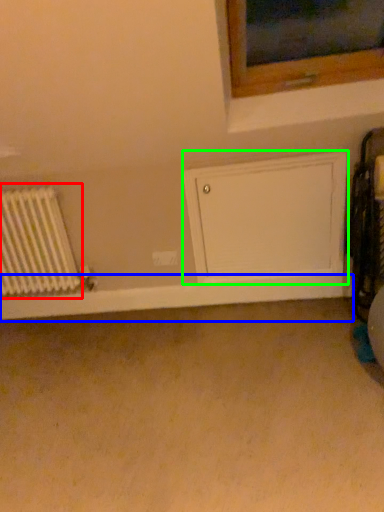
Question: Estimate the real-world distances between objects in this image. Which object is closer to radiator (highlighted by a red box), window sill (highlighted by a blue box) or wide (highlighted by a green box)?

Choices:
 (A) window sill
 (B) wide

Answer: (A)